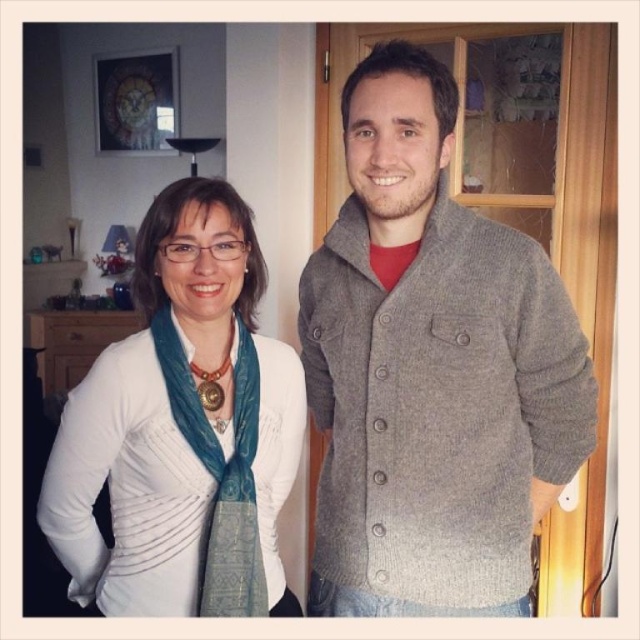
You are a fashion stylist trying to decide whether to place a gray woolen sweater at center on top of a white matte scarf at left or vice versa. Based on the image, which arrangement is currently displayed?

The gray woolen sweater at center is positioned over the white matte scarf at left, so the current arrangement has the sweater on top of the scarf.

You are trying to decide which item to take for a cold day. Both the gray woolen sweater at center and the white matte scarf at left are available. Based on their sizes, which one might be more suitable for layering under a coat?

The gray woolen sweater at center is wider than the white matte scarf at left, so it might be more suitable for layering under a coat since it has a larger width to cover the body properly.